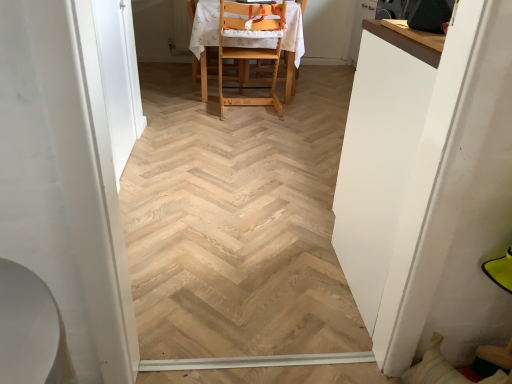
Where is `vacant space in front of light wood highchair at center`? This screenshot has width=512, height=384. vacant space in front of light wood highchair at center is located at coordinates (234, 122).